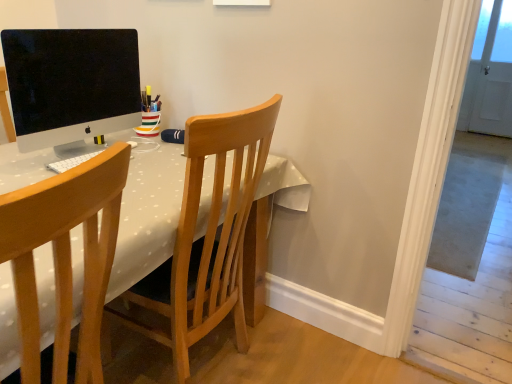
This screenshot has width=512, height=384. I want to click on vacant area that lies to the right of matte black monitor at upper left, so click(x=155, y=162).